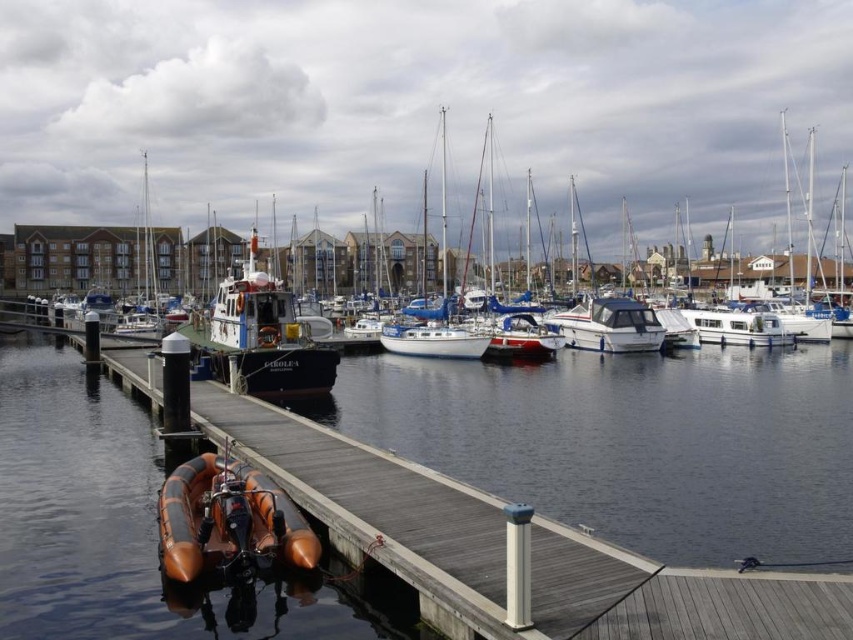
You are planning to move the wooden polished boat at left and the white glossy motorboat at center to a storage area. The storage area has a maximum capacity of 5 meters in length. Given their sizes, which boat can be moved without exceeding the storage limit?

The wooden polished boat at left is larger in size than the white glossy motorboat at center. Therefore, the white glossy motorboat at center is smaller and can be moved without exceeding the storage limit of 5 meters, while the wooden polished boat at left may exceed it.

Looking at this image, you are standing at the wooden dock and want to walk to the point labeled point (573, 262). However, there is an obstacle at point (224, 330). Can you reach your destination without going around the obstacle?

Since point (573, 262) is behind point (224, 330), you cannot reach the destination without going around the obstacle at point (224, 330).

You are standing on the wooden dock and want to board the closest boat. Which boat should you choose between the rubber boat at dock and the wooden polished boat at left?

You should choose the rubber boat at dock because it is closer to the viewer than the wooden polished boat at left.